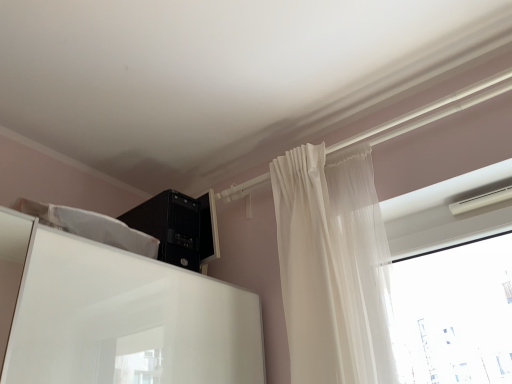
Question: Is point click(177, 195) positioned closer to the camera than point click(335, 256)?

Choices:
 (A) closer
 (B) farther

Answer: (B)

Question: From a real-world perspective, is black plastic computer tower at upper center physically located above or below sheer white curtain at upper right?

Choices:
 (A) below
 (B) above

Answer: (B)

Question: Considering the positions of black plastic computer tower at upper center and sheer white curtain at upper right in the image, is black plastic computer tower at upper center wider or thinner than sheer white curtain at upper right?

Choices:
 (A) wide
 (B) thin

Answer: (A)

Question: Based on their positions, is sheer white curtain at upper right located to the left or right of black plastic computer tower at upper center?

Choices:
 (A) left
 (B) right

Answer: (B)

Question: Is sheer white curtain at upper right wider or thinner than black plastic computer tower at upper center?

Choices:
 (A) wide
 (B) thin

Answer: (B)

Question: From their relative heights in the image, would you say sheer white curtain at upper right is taller or shorter than black plastic computer tower at upper center?

Choices:
 (A) short
 (B) tall

Answer: (B)

Question: Is sheer white curtain at upper right in front of or behind black plastic computer tower at upper center in the image?

Choices:
 (A) behind
 (B) front

Answer: (B)